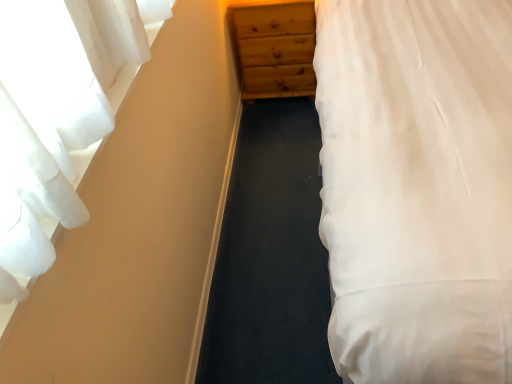
Question: From the image's perspective, is white cotton bed at right below white sheer curtain at left?

Choices:
 (A) no
 (B) yes

Answer: (A)

Question: Is white cotton bed at right outside of white sheer curtain at left?

Choices:
 (A) no
 (B) yes

Answer: (B)

Question: Can you confirm if white cotton bed at right is smaller than white sheer curtain at left?

Choices:
 (A) yes
 (B) no

Answer: (B)

Question: From the image's perspective, is white cotton bed at right on white sheer curtain at left?

Choices:
 (A) yes
 (B) no

Answer: (A)

Question: Considering the relative sizes of white cotton bed at right and white sheer curtain at left in the image provided, is white cotton bed at right thinner than white sheer curtain at left?

Choices:
 (A) yes
 (B) no

Answer: (B)

Question: Is white sheer curtain at left inside white cotton bed at right?

Choices:
 (A) no
 (B) yes

Answer: (A)

Question: Considering the relative sizes of white sheer curtain at left and wooden chest of drawers at center in the image provided, is white sheer curtain at left shorter than wooden chest of drawers at center?

Choices:
 (A) no
 (B) yes

Answer: (B)

Question: Is white sheer curtain at left wider than wooden chest of drawers at center?

Choices:
 (A) yes
 (B) no

Answer: (B)

Question: Does white sheer curtain at left appear on the left side of wooden chest of drawers at center?

Choices:
 (A) no
 (B) yes

Answer: (B)

Question: Is white sheer curtain at left behind wooden chest of drawers at center?

Choices:
 (A) no
 (B) yes

Answer: (A)

Question: Is white sheer curtain at left bigger than wooden chest of drawers at center?

Choices:
 (A) no
 (B) yes

Answer: (A)

Question: Is wooden chest of drawers at center surrounded by white sheer curtain at left?

Choices:
 (A) yes
 (B) no

Answer: (B)

Question: Is the depth of wooden chest of drawers at center less than that of white cotton bed at right?

Choices:
 (A) yes
 (B) no

Answer: (B)